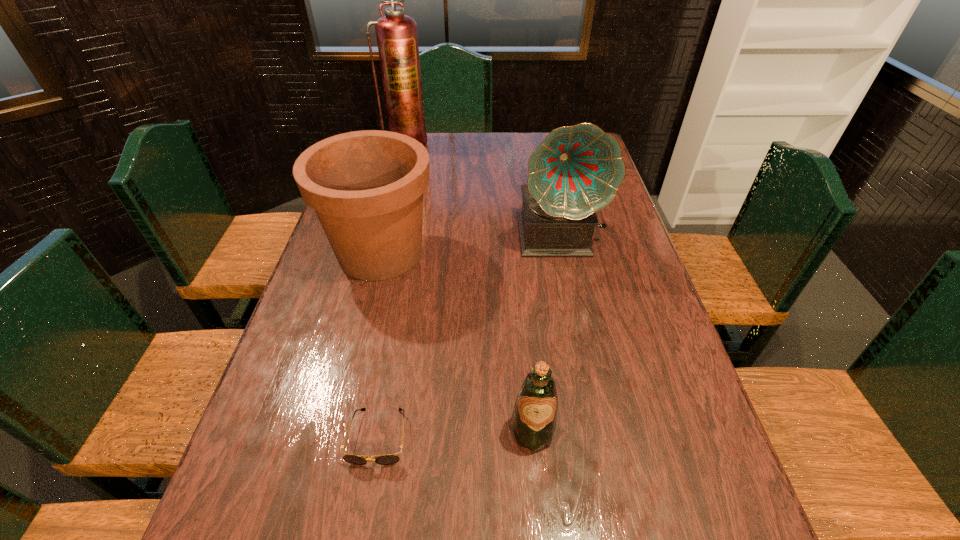
Locate an element on the screen. free spot located on the lenses of the shortest object is located at coordinates (363, 525).

In order to click on object that is at the far edge in this screenshot , I will do `click(397, 39)`.

The width and height of the screenshot is (960, 540). What are the coordinates of `fire extinguisher located in the left edge section of the desktop` in the screenshot? It's located at (397, 39).

Locate an element on the screen. flowerpot that is at the left edge is located at coordinates (366, 187).

This screenshot has height=540, width=960. What are the coordinates of `object present at the right edge` in the screenshot? It's located at (576, 171).

Find the location of a particular element. This screenshot has width=960, height=540. object that is positioned at the far left corner is located at coordinates (397, 39).

Locate an element on the screen. The height and width of the screenshot is (540, 960). free space at the far edge of the desktop is located at coordinates (489, 146).

This screenshot has width=960, height=540. I want to click on vacant area at the left edge of the desktop, so click(x=242, y=459).

Where is `vacant area at the right edge`? This screenshot has width=960, height=540. vacant area at the right edge is located at coordinates (722, 485).

The image size is (960, 540). Find the location of `empty location between the olive oil and the flowerpot`. empty location between the olive oil and the flowerpot is located at coordinates (456, 342).